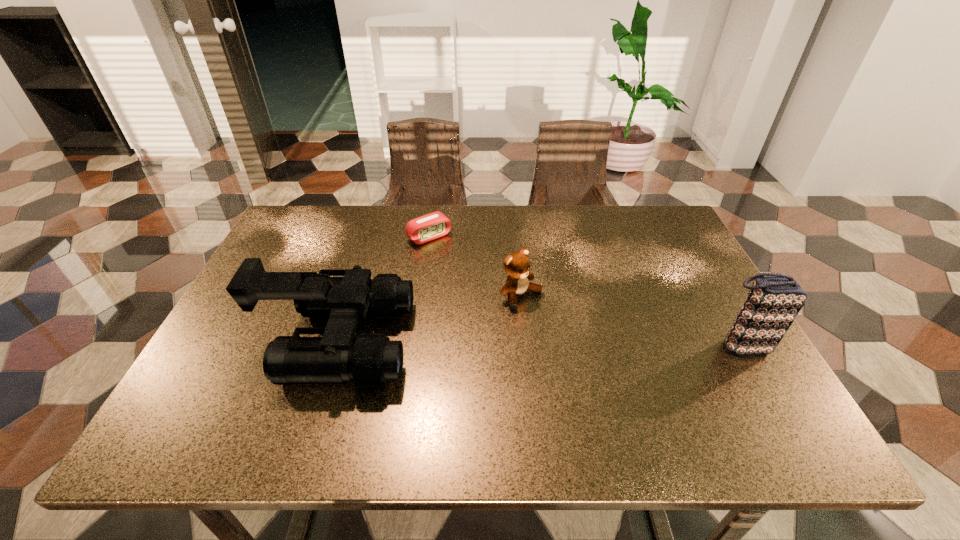
The width and height of the screenshot is (960, 540). Identify the location of vacant space located on the front-facing side of the teddy bear. (649, 396).

This screenshot has width=960, height=540. Identify the location of blank space located 0.110m on the front-facing side of the teddy bear. (569, 334).

Image resolution: width=960 pixels, height=540 pixels. Identify the location of blank space located 0.140m on the front-facing side of the teddy bear. (579, 341).

I want to click on object positioned at the far edge, so click(x=434, y=225).

Where is `object located in the near edge section of the desktop`? object located in the near edge section of the desktop is located at coordinates (371, 360).

Locate an element on the screen. The width and height of the screenshot is (960, 540). object located in the left edge section of the desktop is located at coordinates (371, 360).

This screenshot has height=540, width=960. What are the coordinates of `object situated at the right edge` in the screenshot? It's located at (774, 300).

Identify the location of object that is positioned at the near left corner. (371, 360).

This screenshot has width=960, height=540. I want to click on vacant area at the far edge of the desktop, so 383,224.

This screenshot has height=540, width=960. In the image, there is a desktop. In order to click on free space at the near edge in this screenshot , I will do `click(313, 393)`.